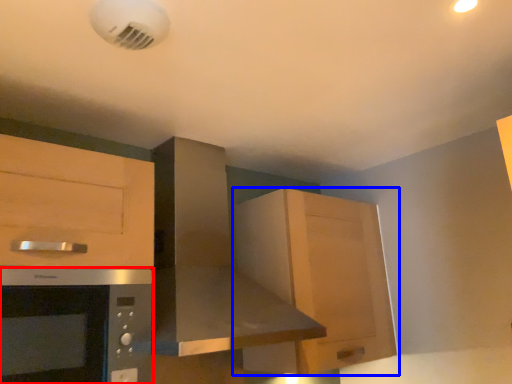
Question: Among these objects, which one is nearest to the camera, microwave oven (highlighted by a red box) or cabinetry (highlighted by a blue box)?

Choices:
 (A) microwave oven
 (B) cabinetry

Answer: (A)